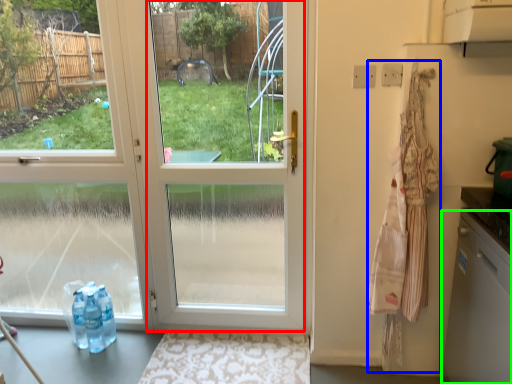
Question: Which object is positioned closest to glass door (highlighted by a red box)? Select from laundry (highlighted by a blue box) and dish washer (highlighted by a green box).

Choices:
 (A) laundry
 (B) dish washer

Answer: (B)